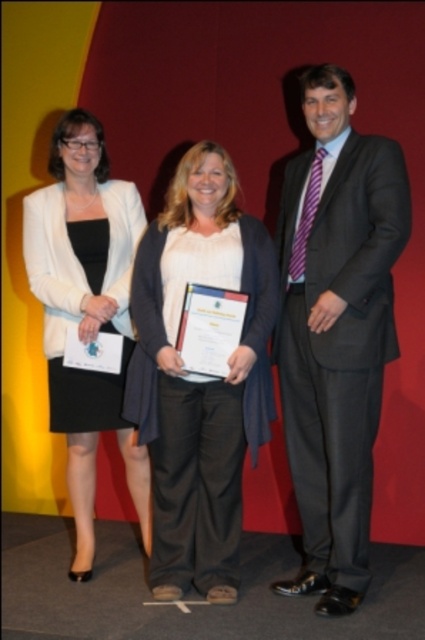
You are a photographer taking a group photo of the dark gray suit at center and the matte white blazer at left. You want to ensure both are visible in the frame. Based on their positions, which one might be partially hidden if you focus on the center?

The matte white blazer at left might be partially hidden because the dark gray suit at center is positioned over it.